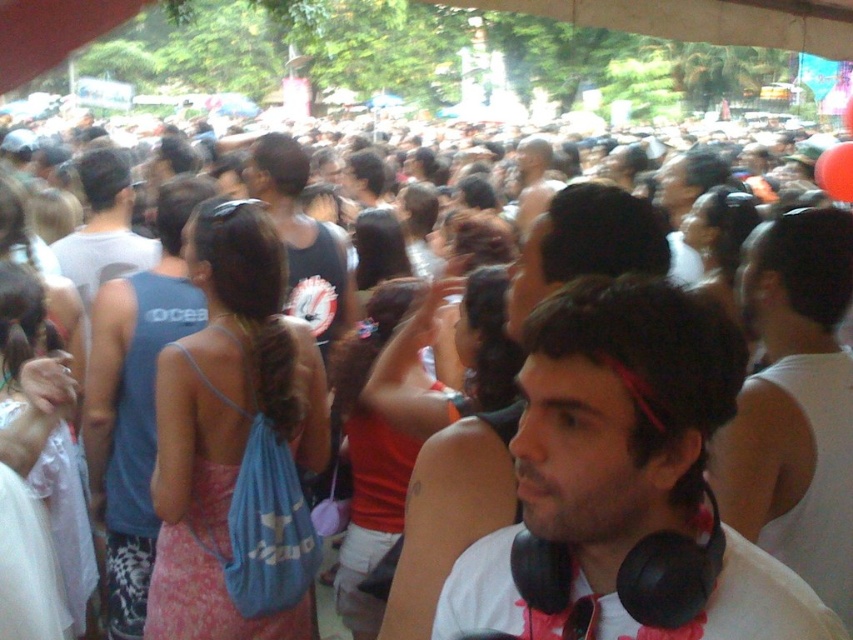
From the picture: You are a photographer trying to capture a clear shot of the black matte headphones at center and the blue fabric tank top at left. Since the crowd is dense, you need to know their relative positions to frame the shot properly. Which object is located to the right of the other?

The black matte headphones at center is positioned on the right side of blue fabric tank top at left.

You are a photographer trying to capture a clear shot of the white matte headphones at center and the blue fabric tank top at left. Which object is shorter in height?

The white matte headphones at center is not as tall as the blue fabric tank top at left, so the white matte headphones at center is shorter in height.

You are organizing a photo shoot and need to ensure that the black matte headphones at center and the blue fabric tank top at left are visible in the frame. Based on their sizes, which object should be placed closer to the camera to ensure both are fully visible?

Since the black matte headphones at center is not as tall as the blue fabric tank top at left, placing the black matte headphones at center closer to the camera will help ensure both objects are fully visible in the frame.